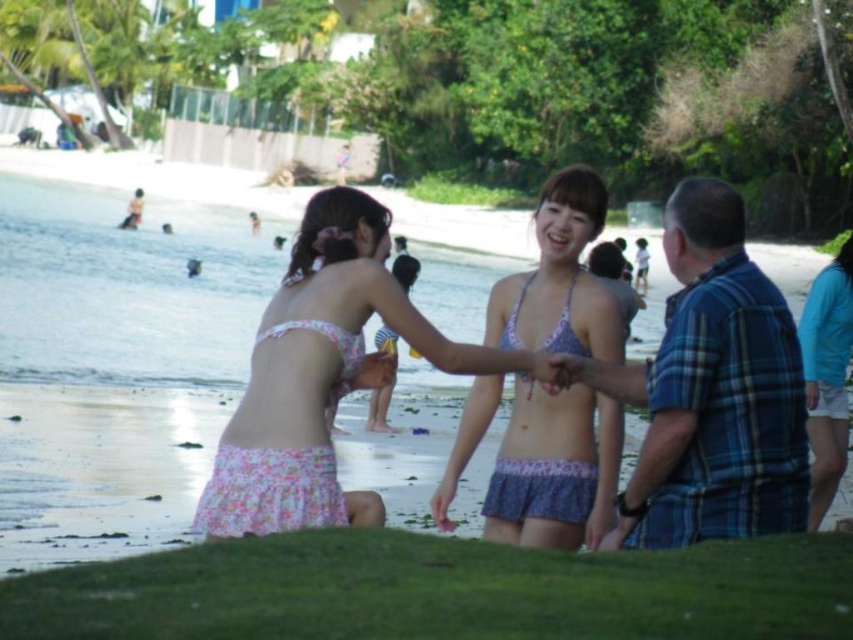
Who is shorter, floral fabric bikini top at center or pink floral bikini at center?

floral fabric bikini top at center is shorter.

Is floral fabric bikini top at center to the right of pink floral bikini at center from the viewer's perspective?

Yes, floral fabric bikini top at center is to the right of pink floral bikini at center.

Which is behind, point (467, 369) or point (395, 272)?

Point (395, 272)

Identify the location of floral fabric bikini top at center. (322, 376).

Based on the photo, which is more to the right, purple printed bikini at center or pink floral bikini at center?

purple printed bikini at center

Is point (602, 420) farther from camera compared to point (409, 275)?

That is False.

Find the location of a particular element. The image size is (853, 640). purple printed bikini at center is located at coordinates (554, 468).

Is blue plaid shirt at right further to camera compared to light blue fabric shorts at lower right?

That is True.

You are a GUI agent. You are given a task and a screenshot of the screen. Output one action in this format:
    pyautogui.click(x=<x>, y=<y>)
    Task: Click on the blue plaid shirt at right
    The width and height of the screenshot is (853, 640).
    Given the screenshot: What is the action you would take?
    pyautogui.click(x=717, y=392)